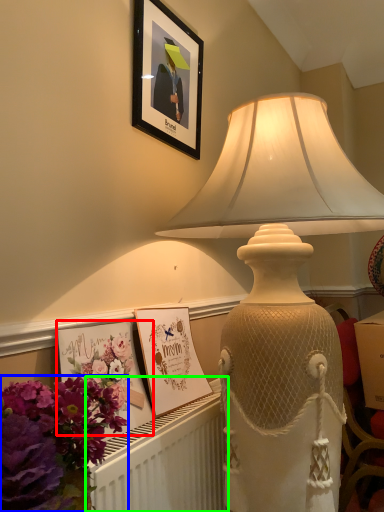
Question: Estimate the real-world distances between objects in this image. Which object is farther from postcard (highlighted by a red box), flower (highlighted by a blue box) or radiator (highlighted by a green box)?

Choices:
 (A) flower
 (B) radiator

Answer: (A)